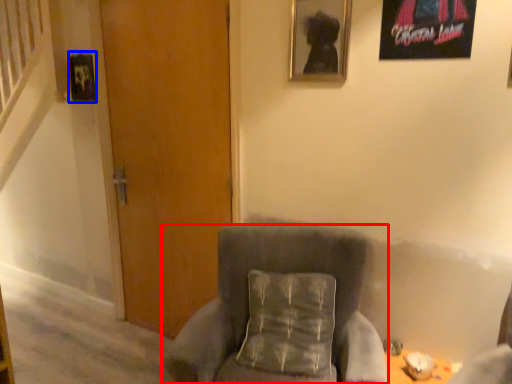
Question: Among these objects, which one is nearest to the camera, chair (highlighted by a red box) or picture frame (highlighted by a blue box)?

Choices:
 (A) chair
 (B) picture frame

Answer: (A)